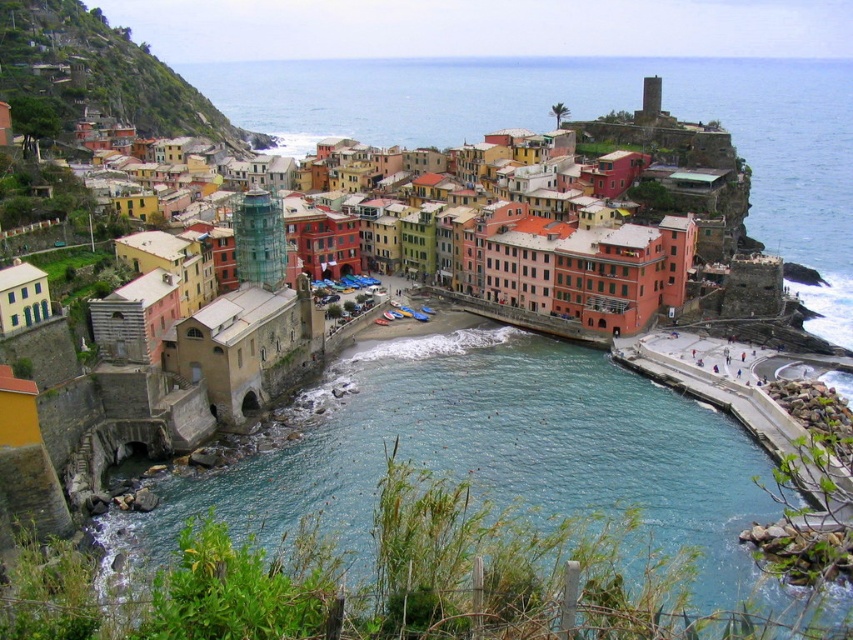
You are standing at the edge of the harbor looking out at the coastal town. You notice two points marked on the image. Which point, point (778, 513) or point (585, 132), is closer to you?

Point (778, 513) is closer to you than point (585, 132).

You are standing at a point in the coastal town and want to know how far you are from the camera. The coordinates of your current position are point [602,232]. Can you determine the distance?

The distance between point [602,232] and the camera is 505.35 feet.